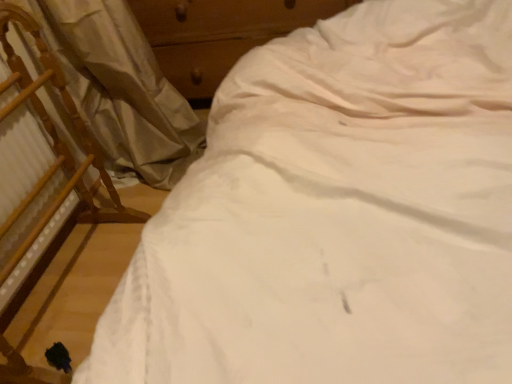
Question: Considering the relative sizes of white fabric curtain at left and wooden dresser at upper center in the image provided, is white fabric curtain at left smaller than wooden dresser at upper center?

Choices:
 (A) yes
 (B) no

Answer: (A)

Question: Considering the relative sizes of white fabric curtain at left and wooden dresser at upper center in the image provided, is white fabric curtain at left wider than wooden dresser at upper center?

Choices:
 (A) yes
 (B) no

Answer: (B)

Question: Is the position of white fabric curtain at left less distant than that of wooden dresser at upper center?

Choices:
 (A) no
 (B) yes

Answer: (B)

Question: Considering the relative positions of white fabric curtain at left and wooden dresser at upper center in the image provided, is white fabric curtain at left to the right of wooden dresser at upper center from the viewer's perspective?

Choices:
 (A) no
 (B) yes

Answer: (A)

Question: Is white fabric curtain at left positioned beyond the bounds of wooden dresser at upper center?

Choices:
 (A) no
 (B) yes

Answer: (B)

Question: Considering the relative positions of white fabric curtain at left and wooden dresser at upper center in the image provided, is white fabric curtain at left to the left of wooden dresser at upper center from the viewer's perspective?

Choices:
 (A) no
 (B) yes

Answer: (B)

Question: From the image's perspective, is wooden dresser at upper center below wooden chair at left?

Choices:
 (A) no
 (B) yes

Answer: (A)

Question: From the image's perspective, is wooden dresser at upper center on top of wooden chair at left?

Choices:
 (A) yes
 (B) no

Answer: (A)

Question: From a real-world perspective, does wooden dresser at upper center sit lower than wooden chair at left?

Choices:
 (A) no
 (B) yes

Answer: (B)

Question: Does wooden dresser at upper center turn towards wooden chair at left?

Choices:
 (A) yes
 (B) no

Answer: (A)

Question: Does wooden dresser at upper center contain wooden chair at left?

Choices:
 (A) no
 (B) yes

Answer: (A)

Question: Does wooden dresser at upper center have a greater width compared to wooden chair at left?

Choices:
 (A) no
 (B) yes

Answer: (B)

Question: Is white fabric curtain at left to the right of wooden chair at left from the viewer's perspective?

Choices:
 (A) no
 (B) yes

Answer: (B)